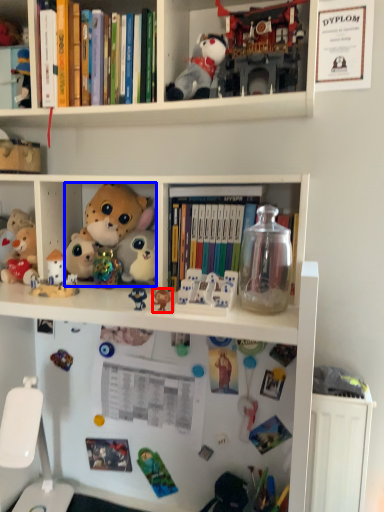
Question: Among these objects, which one is nearest to the camera, toy (highlighted by a red box) or toy (highlighted by a blue box)?

Choices:
 (A) toy
 (B) toy

Answer: (A)